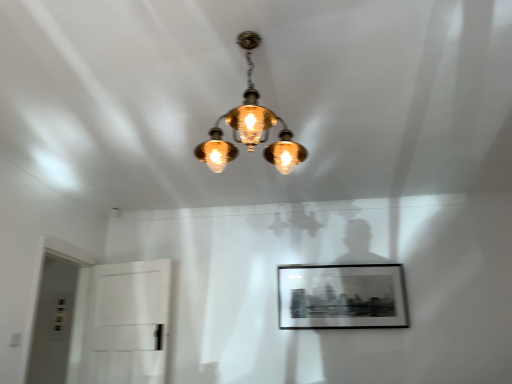
What do you see at coordinates (53, 321) in the screenshot?
I see `transparent glass door at lower left, which is the 1th glass door from left to right` at bounding box center [53, 321].

This screenshot has height=384, width=512. Describe the element at coordinates (342, 296) in the screenshot. I see `black matte picture frame at center` at that location.

What is the approximate height of black matte picture frame at center?

It is 21.88 inches.

Find the location of `transparent glass door at lower left, placed as the 2th glass door when sorted from right to left`. transparent glass door at lower left, placed as the 2th glass door when sorted from right to left is located at coordinates (53, 321).

Is black matte picture frame at center closer to the viewer compared to transparent glass door at lower left, which is the 1th glass door from left to right?

That is False.

In the scene shown: Is black matte picture frame at center smaller than transparent glass door at lower left, placed as the 2th glass door when sorted from right to left?

Indeed, black matte picture frame at center has a smaller size compared to transparent glass door at lower left, placed as the 2th glass door when sorted from right to left.

Is black matte picture frame at center turned away from transparent glass door at lower left, placed as the 2th glass door when sorted from right to left?

black matte picture frame at center is not turned away from transparent glass door at lower left, placed as the 2th glass door when sorted from right to left.

Is black matte picture frame at center at the back of matte brass chandelier at center?

No, matte brass chandelier at center is not facing the opposite direction of black matte picture frame at center.

Measure the distance from matte brass chandelier at center to black matte picture frame at center.

matte brass chandelier at center is 1.37 meters from black matte picture frame at center.

From the image's perspective, is matte brass chandelier at center under black matte picture frame at center?

No, from the image's perspective, matte brass chandelier at center is not beneath black matte picture frame at center.

What are the coordinates of `picture frame on the right of matte brass chandelier at center` in the screenshot? It's located at (342, 296).

Is transparent glass door at lower left, placed as the 2th glass door when sorted from right to left, to the left or to the right of white glossy door at left, which ranks as the first glass door in right-to-left order, in the image?

In the image, transparent glass door at lower left, placed as the 2th glass door when sorted from right to left, appears on the left side of white glossy door at left, which ranks as the first glass door in right-to-left order.

Between transparent glass door at lower left, placed as the 2th glass door when sorted from right to left, and white glossy door at left, which ranks as the first glass door in right-to-left order, which one has less height?

Standing shorter between the two is white glossy door at left, which ranks as the first glass door in right-to-left order.

From the image's perspective, which one is positioned higher, transparent glass door at lower left, placed as the 2th glass door when sorted from right to left, or white glossy door at left, which ranks as the first glass door in right-to-left order?

transparent glass door at lower left, placed as the 2th glass door when sorted from right to left, is shown above in the image.

Looking at this image, which of these two, transparent glass door at lower left, placed as the 2th glass door when sorted from right to left, or white glossy door at left, which ranks as the first glass door in right-to-left order, is bigger?

With larger size is transparent glass door at lower left, placed as the 2th glass door when sorted from right to left.

Which of these two, transparent glass door at lower left, placed as the 2th glass door when sorted from right to left, or black matte picture frame at center, stands shorter?

With less height is black matte picture frame at center.

From a real-world perspective, is transparent glass door at lower left, which is the 1th glass door from left to right, over black matte picture frame at center?

Actually, transparent glass door at lower left, which is the 1th glass door from left to right, is physically below black matte picture frame at center in the real world.

From the image's perspective, which one is positioned lower, transparent glass door at lower left, which is the 1th glass door from left to right, or black matte picture frame at center?

transparent glass door at lower left, which is the 1th glass door from left to right, appears lower in the image.

Is point (56, 279) less distant than point (354, 291)?

No, (56, 279) is behind (354, 291).

From a real-world perspective, is white glossy door at left, which ranks as the first glass door in right-to-left order, below transparent glass door at lower left, which is the 1th glass door from left to right?

Yes, from a real-world perspective, white glossy door at left, which ranks as the first glass door in right-to-left order, is beneath transparent glass door at lower left, which is the 1th glass door from left to right.

Can you confirm if white glossy door at left, which ranks as the first glass door in right-to-left order, is positioned to the left of transparent glass door at lower left, placed as the 2th glass door when sorted from right to left?

No.

Looking at the image, does white glossy door at left, which ranks as the first glass door in right-to-left order, seem bigger or smaller compared to transparent glass door at lower left, which is the 1th glass door from left to right?

Clearly, white glossy door at left, which ranks as the first glass door in right-to-left order, is smaller in size than transparent glass door at lower left, which is the 1th glass door from left to right.

From the image's perspective, is matte brass chandelier at center below white glossy door at left, which appears as the second glass door when viewed from the left?

No, from the image's perspective, matte brass chandelier at center is not below white glossy door at left, which appears as the second glass door when viewed from the left.

Does matte brass chandelier at center have a lesser height compared to white glossy door at left, which ranks as the first glass door in right-to-left order?

Correct, matte brass chandelier at center is not as tall as white glossy door at left, which ranks as the first glass door in right-to-left order.

Does matte brass chandelier at center turn towards white glossy door at left, which appears as the second glass door when viewed from the left?

No, matte brass chandelier at center is not aimed at white glossy door at left, which appears as the second glass door when viewed from the left.

Between point (245, 109) and point (96, 317), which one is positioned in front?

The point (245, 109) is closer.

Is white glossy door at left, which appears as the second glass door when viewed from the left, outside of black matte picture frame at center?

Yes, white glossy door at left, which appears as the second glass door when viewed from the left, is located beyond the bounds of black matte picture frame at center.

Measure the distance from white glossy door at left, which appears as the second glass door when viewed from the left, to black matte picture frame at center.

white glossy door at left, which appears as the second glass door when viewed from the left, and black matte picture frame at center are 4.69 feet apart.

From a real-world perspective, does white glossy door at left, which ranks as the first glass door in right-to-left order, stand above black matte picture frame at center?

No, from a real-world perspective, white glossy door at left, which ranks as the first glass door in right-to-left order, is not on top of black matte picture frame at center.

This screenshot has height=384, width=512. Find the location of `picture frame positioned vertically above the transparent glass door at lower left, which is the 1th glass door from left to right (from a real-world perspective)`. picture frame positioned vertically above the transparent glass door at lower left, which is the 1th glass door from left to right (from a real-world perspective) is located at coordinates (342, 296).

The height and width of the screenshot is (384, 512). I want to click on picture frame lying behind the matte brass chandelier at center, so click(x=342, y=296).

From the picture: From the image, which object appears to be nearer to white glossy door at left, which appears as the second glass door when viewed from the left, transparent glass door at lower left, which is the 1th glass door from left to right, or black matte picture frame at center?

transparent glass door at lower left, which is the 1th glass door from left to right.

Based on their spatial positions, is transparent glass door at lower left, placed as the 2th glass door when sorted from right to left, or matte brass chandelier at center further from black matte picture frame at center?

transparent glass door at lower left, placed as the 2th glass door when sorted from right to left, lies further to black matte picture frame at center than the other object.

Looking at the image, which one is located further to white glossy door at left, which ranks as the first glass door in right-to-left order, black matte picture frame at center or transparent glass door at lower left, placed as the 2th glass door when sorted from right to left?

black matte picture frame at center is further to white glossy door at left, which ranks as the first glass door in right-to-left order.

Looking at the image, which one is located further to white glossy door at left, which appears as the second glass door when viewed from the left, black matte picture frame at center or matte brass chandelier at center?

matte brass chandelier at center is further to white glossy door at left, which appears as the second glass door when viewed from the left.

From the picture: When comparing their distances from transparent glass door at lower left, placed as the 2th glass door when sorted from right to left, does black matte picture frame at center or white glossy door at left, which ranks as the first glass door in right-to-left order, seem further?

black matte picture frame at center lies further to transparent glass door at lower left, placed as the 2th glass door when sorted from right to left, than the other object.

When comparing their distances from black matte picture frame at center, does matte brass chandelier at center or white glossy door at left, which appears as the second glass door when viewed from the left, seem closer?

Among the two, matte brass chandelier at center is located nearer to black matte picture frame at center.

Estimate the real-world distances between objects in this image. Which object is further from transparent glass door at lower left, which is the 1th glass door from left to right, matte brass chandelier at center or white glossy door at left, which ranks as the first glass door in right-to-left order?

The object further to transparent glass door at lower left, which is the 1th glass door from left to right, is matte brass chandelier at center.

Based on their spatial positions, is transparent glass door at lower left, which is the 1th glass door from left to right, or white glossy door at left, which appears as the second glass door when viewed from the left, further from black matte picture frame at center?

transparent glass door at lower left, which is the 1th glass door from left to right, is positioned further to the anchor black matte picture frame at center.

Identify the location of glass door between matte brass chandelier at center and white glossy door at left, which appears as the second glass door when viewed from the left, along the z-axis. (53, 321).

What are the coordinates of `glass door located between transparent glass door at lower left, which is the 1th glass door from left to right, and black matte picture frame at center in the left-right direction` in the screenshot? It's located at (129, 323).

Identify the location of lamp between transparent glass door at lower left, placed as the 2th glass door when sorted from right to left, and black matte picture frame at center. This screenshot has height=384, width=512. (250, 127).